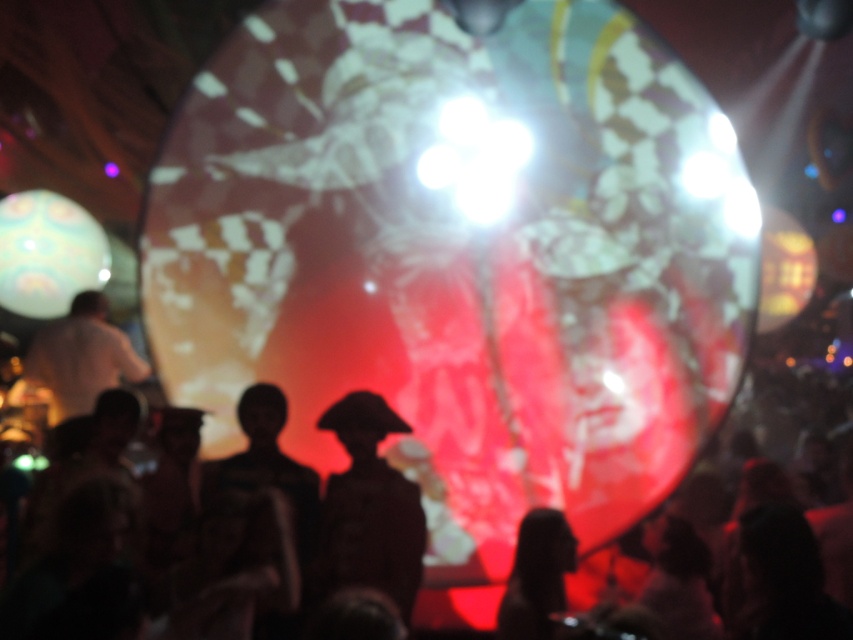
Question: Among these objects, which one is farthest from the camera?

Choices:
 (A) silhouette crowd at center
 (B) dark matte hat at center
 (C) silhouette head at lower center

Answer: (B)

Question: Is silhouette crowd at center below silhouette head at lower center?

Choices:
 (A) yes
 (B) no

Answer: (B)

Question: Is silhouette crowd at center above silhouette head at lower center?

Choices:
 (A) no
 (B) yes

Answer: (B)

Question: Is silhouette crowd at center further to camera compared to silhouette head at lower center?

Choices:
 (A) yes
 (B) no

Answer: (B)

Question: Which of the following is the closest to the observer?

Choices:
 (A) (334, 429)
 (B) (727, 419)
 (C) (535, 637)

Answer: (C)

Question: Which object appears closest to the camera in this image?

Choices:
 (A) silhouette head at lower center
 (B) dark matte hat at center
 (C) silhouette crowd at center

Answer: (C)